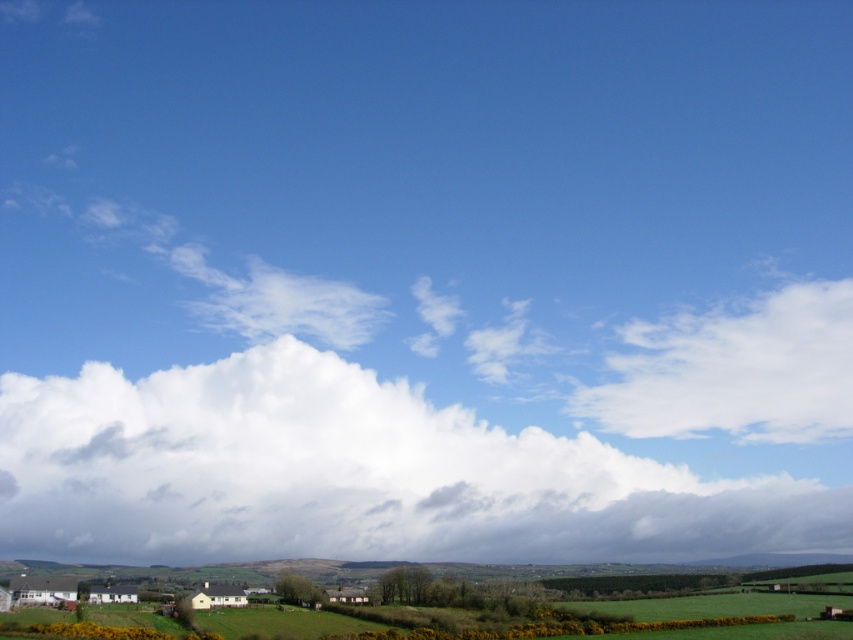
Question: Is white fluffy cloud at center below white fluffy cloud at upper right?

Choices:
 (A) yes
 (B) no

Answer: (A)

Question: Is white fluffy cloud at center smaller than white fluffy cloud at upper right?

Choices:
 (A) no
 (B) yes

Answer: (A)

Question: Among these objects, which one is nearest to the camera?

Choices:
 (A) white fluffy cloud at center
 (B) white fluffy cloud at upper right

Answer: (A)

Question: Among these points, which one is nearest to the camera?

Choices:
 (A) (711, 486)
 (B) (694, 422)

Answer: (A)

Question: Which of the following is the farthest from the observer?

Choices:
 (A) (44, 470)
 (B) (676, 388)

Answer: (A)

Question: Can you confirm if white fluffy cloud at center is positioned to the right of white fluffy cloud at upper right?

Choices:
 (A) yes
 (B) no

Answer: (B)